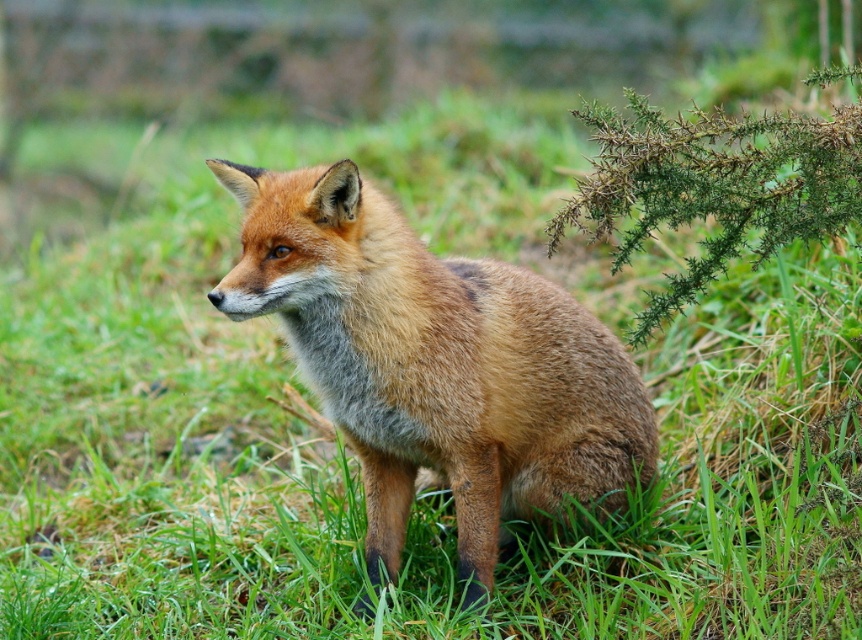
You are a photographer trying to capture the shiny orange fur fox at center and the green spiky plant at upper right in the same frame. Based on their sizes, which one would appear larger in your photo?

The shiny orange fur fox at center appears larger in the photo because it is taller than the green spiky plant at upper right.

You are an animal photographer trying to capture the shiny orange fur fox at center and the green spiky plant at upper right in the same frame. Based on their sizes, which one should you focus on first to ensure both are in the shot?

A: The shiny orange fur fox at center is bigger than the green spiky plant at upper right, so you should focus on the shiny orange fur fox at center first to ensure both fit in the frame.